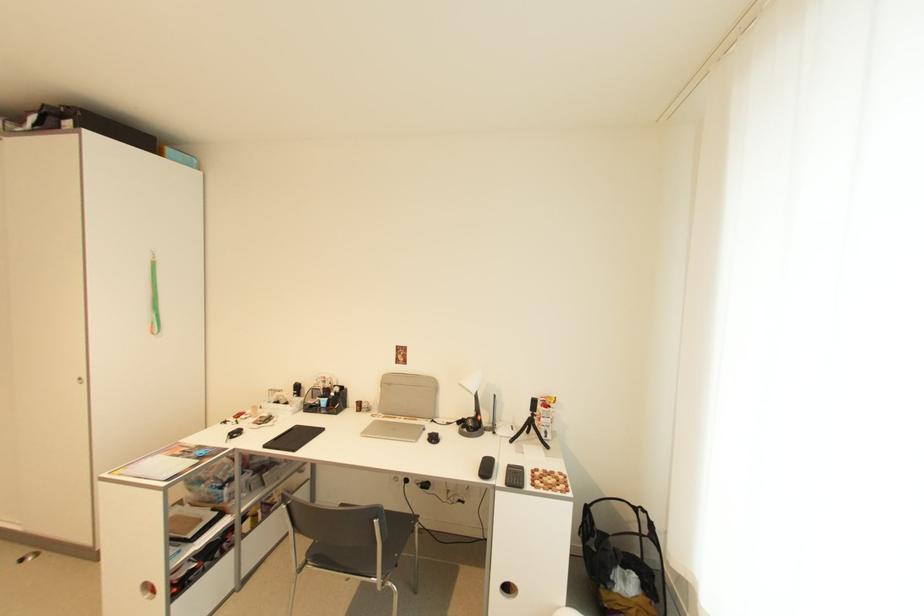
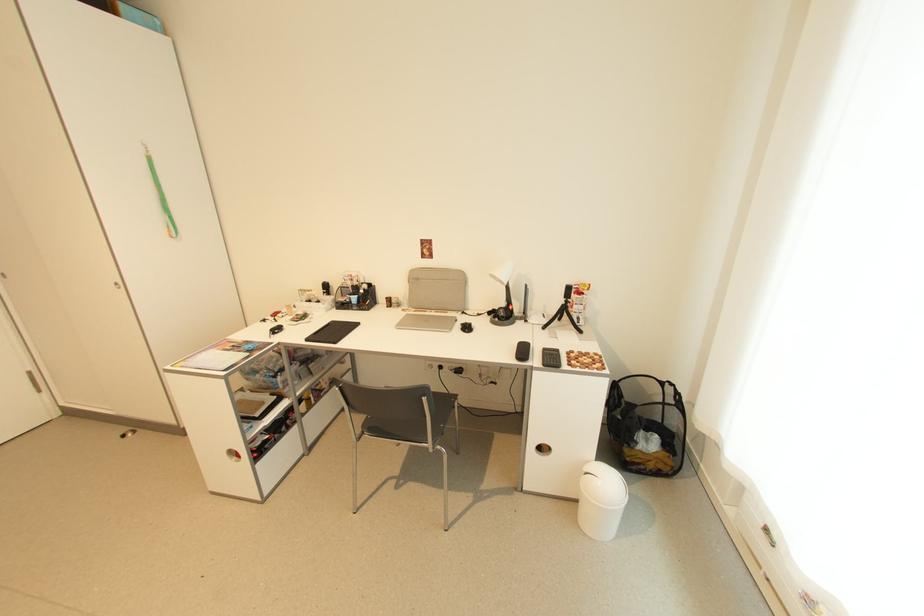
Question: How did the camera likely rotate?

Choices:
 (A) Left
 (B) Right
 (C) Up
 (D) Down

Answer: (D)